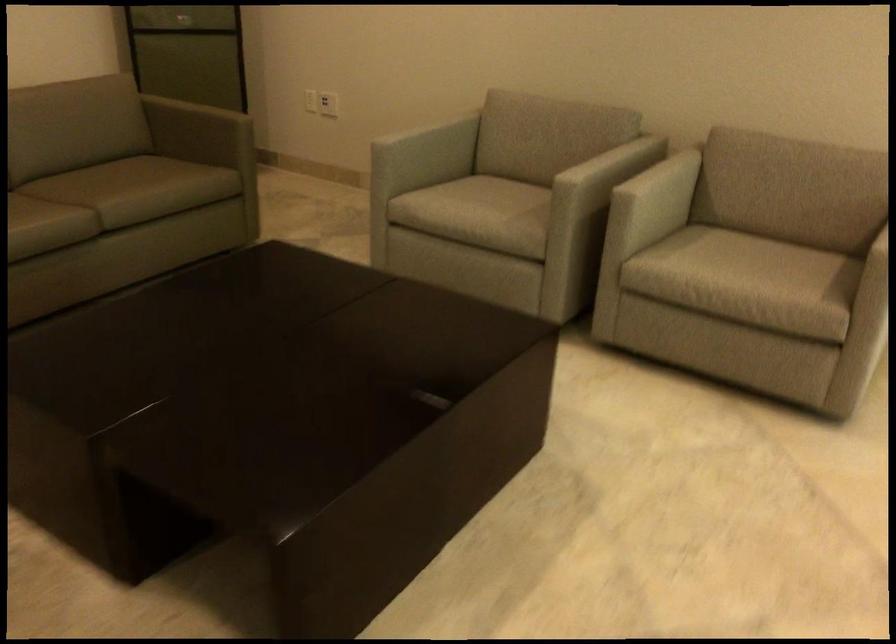
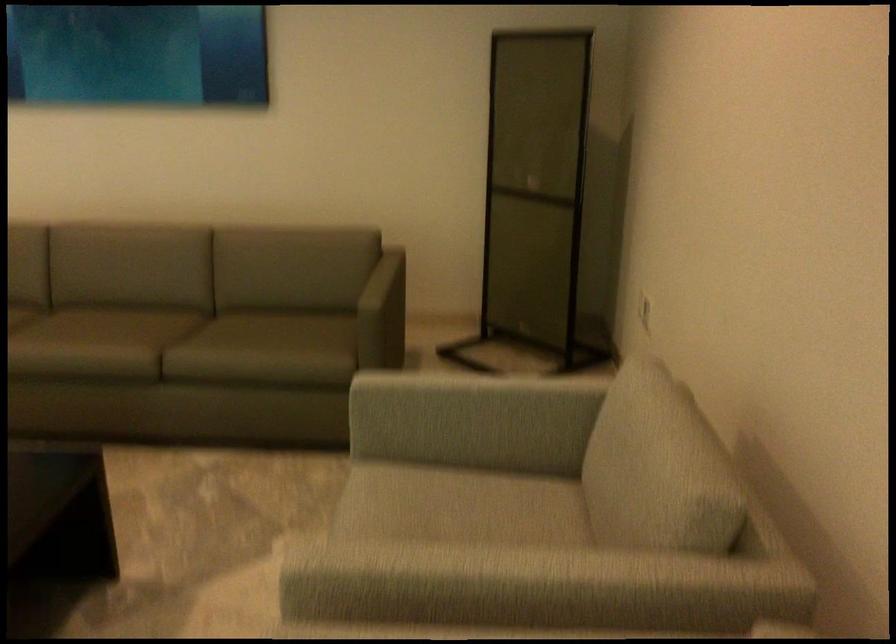
In the second image, find the point that corresponds to [444,185] in the first image.

(455, 491)